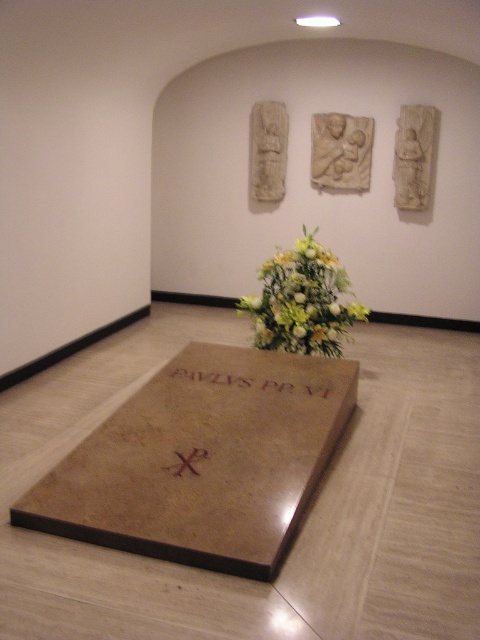
Can you confirm if dark brown stone slab at center is positioned above brown wooden cross at center?

Yes, dark brown stone slab at center is above brown wooden cross at center.

Does point (169, 372) come closer to viewer compared to point (180, 452)?

That is False.

Is point (320, 388) in front of point (180, 456)?

That is False.

Find the location of a particular element. dark brown stone slab at center is located at coordinates (251, 381).

Between yellow-green bouquet at center and dark brown stone slab at center, which one appears on the left side from the viewer's perspective?

dark brown stone slab at center

Consider the image. Is yellow-green bouquet at center above dark brown stone slab at center?

Yes.

Image resolution: width=480 pixels, height=640 pixels. What are the coordinates of `yellow-green bouquet at center` in the screenshot? It's located at (301, 301).

Is yellow-green bouquet at center behind brown wooden cross at center?

Yes, it is behind brown wooden cross at center.

Where is `yellow-green bouquet at center`? The image size is (480, 640). yellow-green bouquet at center is located at coordinates (301, 301).